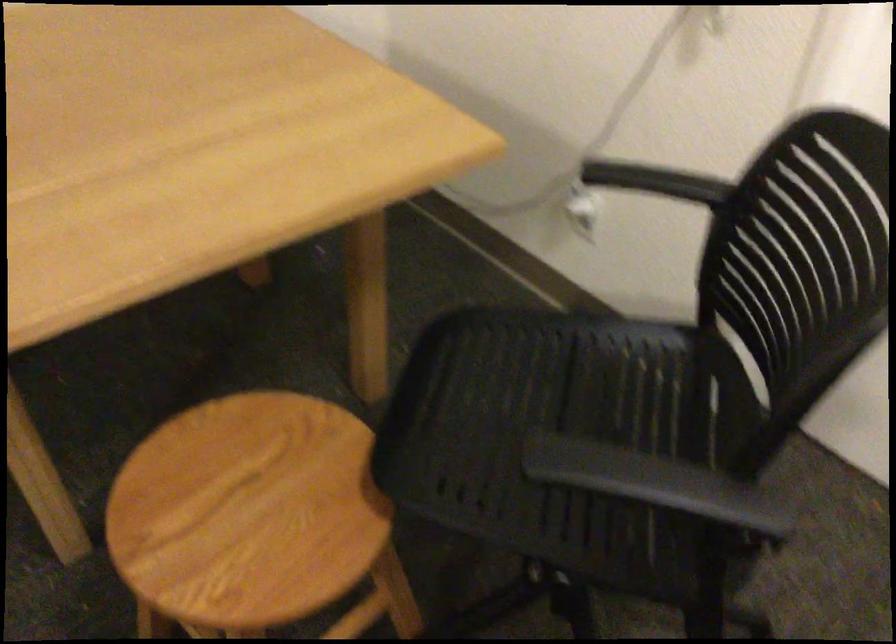
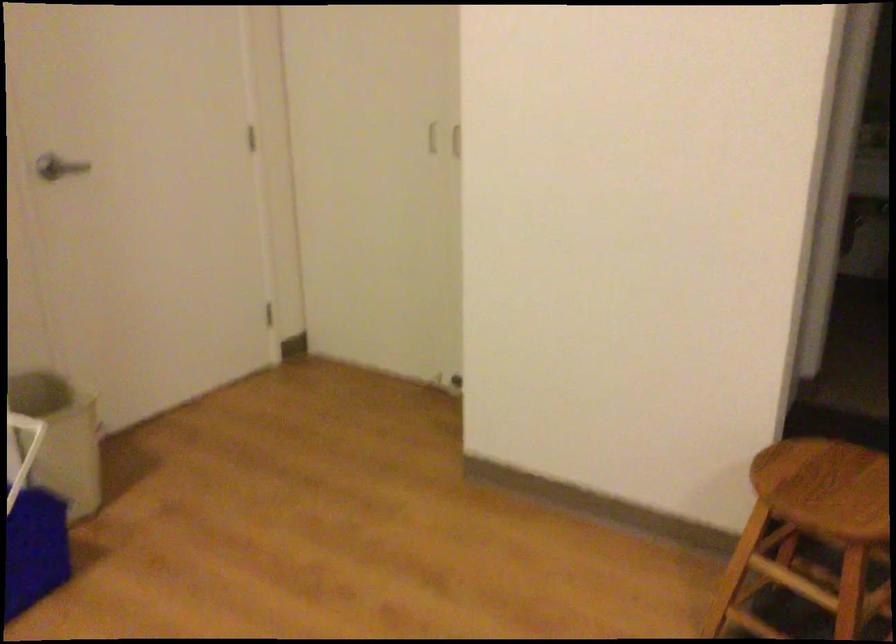
Question: The images are taken continuously from a first-person perspective. In which direction is your viewpoint rotating?

Choices:
 (A) Left
 (B) Right
 (C) Up
 (D) Down

Answer: (A)